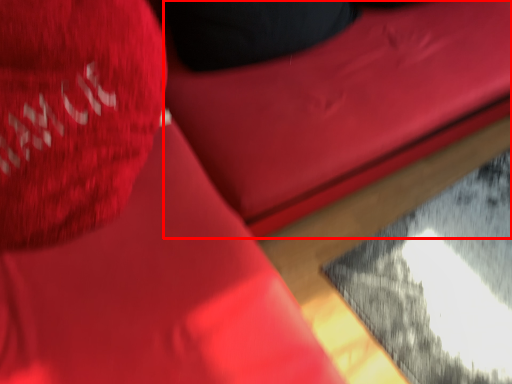
Question: From the image's perspective, where is bean bag chair (annotated by the red box) located relative to throw pillow?

Choices:
 (A) below
 (B) above

Answer: (B)